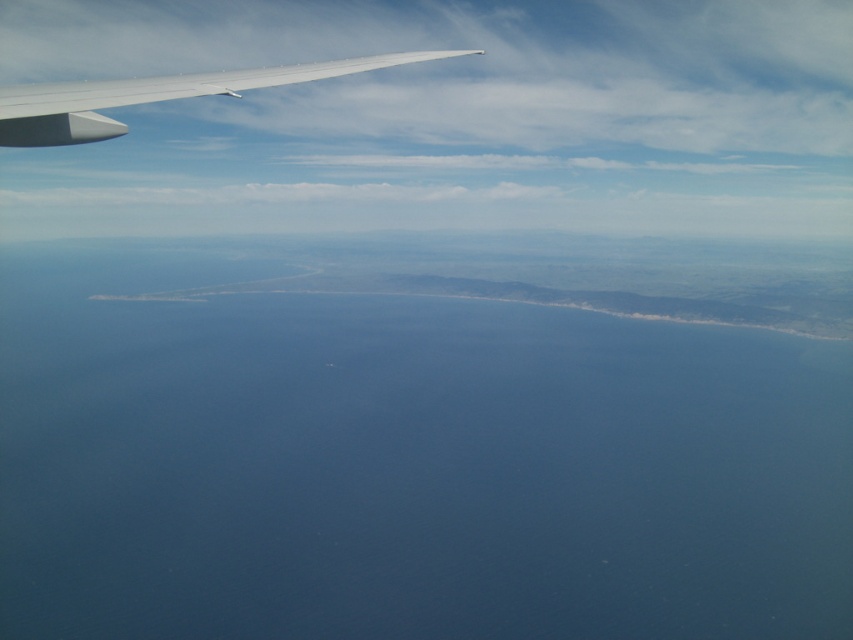
Question: Is blue water at center below white matte wing at upper left?

Choices:
 (A) yes
 (B) no

Answer: (A)

Question: Which point appears closest to the camera in this image?

Choices:
 (A) (96, 90)
 (B) (123, 372)

Answer: (A)

Question: Is blue water at center thinner than white matte wing at upper left?

Choices:
 (A) no
 (B) yes

Answer: (A)

Question: Can you confirm if blue water at center is wider than white matte wing at upper left?

Choices:
 (A) no
 (B) yes

Answer: (B)